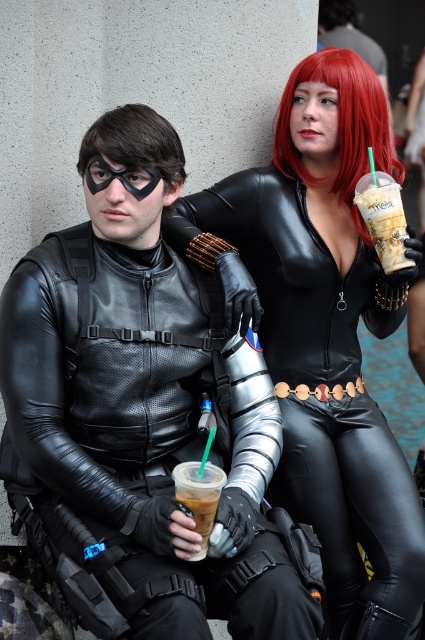
Question: Which point is farther from the camera taking this photo?

Choices:
 (A) (350, 108)
 (B) (379, 93)
 (C) (175, 172)
 (D) (175, 483)

Answer: (B)

Question: Which point is farther to the camera?

Choices:
 (A) (201, 468)
 (B) (380, 604)
 (C) (90, 168)

Answer: (B)

Question: Does iced coffee at lower center have a greater width compared to black matte/glossy goggles at left?

Choices:
 (A) no
 (B) yes

Answer: (A)

Question: Which object appears closest to the camera in this image?

Choices:
 (A) black matte/glossy goggles at left
 (B) red matte wig at upper right
 (C) matte black suit at center
 (D) iced coffee at lower center

Answer: (C)

Question: Can you confirm if matte black suit at center is thinner than shiny black bodysuit at upper right?

Choices:
 (A) yes
 (B) no

Answer: (B)

Question: Does shiny black bodysuit at upper right appear under black matte/glossy goggles at left?

Choices:
 (A) yes
 (B) no

Answer: (A)